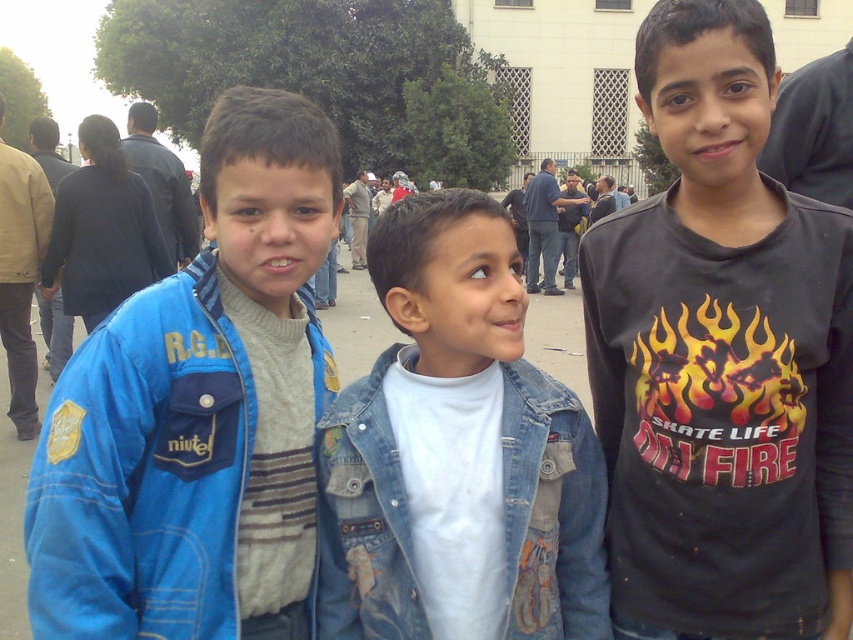
Can you confirm if brushed denim jacket at left is shorter than denim jacket at center?

Incorrect, brushed denim jacket at left's height does not fall short of denim jacket at center's.

Can you confirm if brushed denim jacket at left is smaller than denim jacket at center?

Actually, brushed denim jacket at left might be larger than denim jacket at center.

Between point (219, 205) and point (521, 292), which one is positioned in front?

Point (521, 292) is more forward.

Where is `brushed denim jacket at left`? brushed denim jacket at left is located at coordinates 199,412.

I want to click on black matte shirt at center, so click(x=721, y=356).

Does black matte shirt at center appear on the left side of denim jacket at center?

In fact, black matte shirt at center is to the right of denim jacket at center.

I want to click on black matte shirt at center, so 721,356.

Between black matte shirt at center and dark blue jacket at upper left, which one is positioned higher?

dark blue jacket at upper left

Between black matte shirt at center and dark blue jacket at upper left, which one has more height?

black matte shirt at center is taller.

Which is behind, point (775, 563) or point (103, 188)?

Positioned behind is point (103, 188).

Locate an element on the screen. black matte shirt at center is located at coordinates (721, 356).